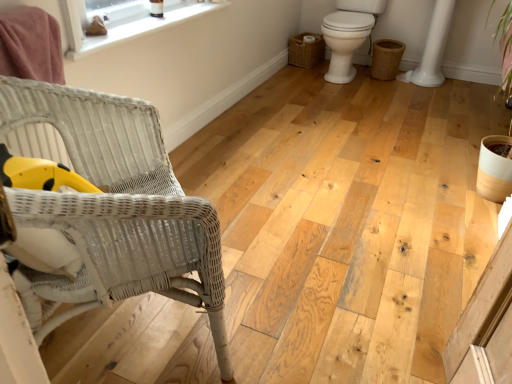
The width and height of the screenshot is (512, 384). What do you see at coordinates (306, 50) in the screenshot?
I see `woven brown basket at right, the first basket when ordered from left to right` at bounding box center [306, 50].

Where is `white wicker chair at left`? white wicker chair at left is located at coordinates 115,210.

Locate an element on the screen. The height and width of the screenshot is (384, 512). woven brown basket at right, the first basket when ordered from left to right is located at coordinates (306, 50).

Considering the sizes of objects white wicker chair at left and woven brown basket at right, the first basket when ordered from left to right, in the image provided, who is taller, white wicker chair at left or woven brown basket at right, the first basket when ordered from left to right,?

With more height is white wicker chair at left.

Between white wicker chair at left and woven brown basket at right, the first basket when ordered from left to right, which one has smaller size?

woven brown basket at right, the first basket when ordered from left to right.

Is white wicker chair at left next to woven brown basket at right, the second basket viewed from the right?

No, white wicker chair at left is not in contact with woven brown basket at right, the second basket viewed from the right.

Is white wicker chair at left located outside woven brown basket at right, the second basket viewed from the right?

Yes.

From the image's perspective, which is above, braided wicker basket at lower right, positioned as the 1th basket in right-to-left order, or white glossy toilet at right?

white glossy toilet at right, from the image's perspective.

Based on their sizes in the image, would you say braided wicker basket at lower right, the second basket when ordered from left to right, is bigger or smaller than white glossy toilet at right?

In the image, braided wicker basket at lower right, the second basket when ordered from left to right, appears to be smaller than white glossy toilet at right.

Is braided wicker basket at lower right, the second basket when ordered from left to right, not close to white glossy toilet at right?

No, braided wicker basket at lower right, the second basket when ordered from left to right, is in close proximity to white glossy toilet at right.

From a real-world perspective, who is located lower, braided wicker basket at lower right, the second basket when ordered from left to right, or white glossy toilet at right?

In real-world perspective, braided wicker basket at lower right, the second basket when ordered from left to right, is lower.

From the image's perspective, is white smooth window sill at upper left located above white glossy toilet at right?

No, from the image's perspective, white smooth window sill at upper left is not over white glossy toilet at right.

Is point (143, 10) closer or farther from the camera than point (362, 36)?

Point (143, 10) is closer to the camera than point (362, 36).

Is white smooth window sill at upper left facing towards white glossy toilet at right?

No, white smooth window sill at upper left is not facing towards white glossy toilet at right.

Is white smooth window sill at upper left directly adjacent to white glossy toilet at right?

white smooth window sill at upper left and white glossy toilet at right are clearly separated.

The image size is (512, 384). Find the location of `basket lying on the left of braided wicker basket at lower right, positioned as the 1th basket in right-to-left order`. basket lying on the left of braided wicker basket at lower right, positioned as the 1th basket in right-to-left order is located at coordinates (306, 50).

Is point (308, 49) farther from viewer compared to point (389, 47)?

Yes.

From the image's perspective, is woven brown basket at right, the second basket viewed from the right, beneath braided wicker basket at lower right, positioned as the 1th basket in right-to-left order?

No.

Between white wicker chair at left and white glossy toilet at right, which one appears on the right side from the viewer's perspective?

white glossy toilet at right.

Can you tell me how much white wicker chair at left and white glossy toilet at right differ in facing direction?

The facing directions of white wicker chair at left and white glossy toilet at right are 136 degrees apart.

Does white wicker chair at left touch white glossy toilet at right?

No.

From the image's perspective, would you say white wicker chair at left is shown under white glossy toilet at right?

Indeed, from the image's perspective, white wicker chair at left is shown beneath white glossy toilet at right.

From the image's perspective, is white smooth window sill at upper left on braided wicker basket at lower right, positioned as the 1th basket in right-to-left order?

No.

Is white smooth window sill at upper left inside the boundaries of braided wicker basket at lower right, the second basket when ordered from left to right, or outside?

white smooth window sill at upper left exists outside the volume of braided wicker basket at lower right, the second basket when ordered from left to right.

From a real-world perspective, which object rests below the other?

From a 3D spatial view, braided wicker basket at lower right, the second basket when ordered from left to right, is below.

How many degrees apart are the facing directions of white smooth window sill at upper left and braided wicker basket at lower right, positioned as the 1th basket in right-to-left order?

They differ by 96 degrees in their facing directions.

From a real-world perspective, which is physically above, white glossy toilet at right or white smooth window sill at upper left?

white smooth window sill at upper left, from a real-world perspective.

Which is behind, point (357, 26) or point (170, 7)?

The point (357, 26) is more distant.

Is white glossy toilet at right completely or partially outside of white smooth window sill at upper left?

Yes, white glossy toilet at right is located beyond the bounds of white smooth window sill at upper left.

How far apart are white glossy toilet at right and white smooth window sill at upper left?

The distance of white glossy toilet at right from white smooth window sill at upper left is 1.30 meters.

Where is `the 2nd basket positioned above the white wicker chair at left (from the image's perspective)`? the 2nd basket positioned above the white wicker chair at left (from the image's perspective) is located at coordinates (306, 50).

The image size is (512, 384). I want to click on basket that appears on the right of white glossy toilet at right, so click(x=386, y=59).

Estimate the real-world distances between objects in this image. Which object is closer to woven brown basket at right, the first basket when ordered from left to right, white smooth window sill at upper left or white wicker chair at left?

white smooth window sill at upper left is closer to woven brown basket at right, the first basket when ordered from left to right.

When comparing their distances from white smooth window sill at upper left, does white glossy toilet at right or woven brown basket at right, the second basket viewed from the right, seem further?

Based on the image, woven brown basket at right, the second basket viewed from the right, appears to be further to white smooth window sill at upper left.

Looking at this image, when comparing their distances from white wicker chair at left, does woven brown basket at right, the first basket when ordered from left to right, or white glossy toilet at right seem further?

Among the two, woven brown basket at right, the first basket when ordered from left to right, is located further to white wicker chair at left.

Which object lies further to the anchor point white glossy toilet at right, white wicker chair at left or woven brown basket at right, the first basket when ordered from left to right?

The object further to white glossy toilet at right is white wicker chair at left.

Which object lies nearer to the anchor point woven brown basket at right, the first basket when ordered from left to right, braided wicker basket at lower right, the second basket when ordered from left to right, or white glossy toilet at right?

The object closer to woven brown basket at right, the first basket when ordered from left to right, is white glossy toilet at right.

Estimate the real-world distances between objects in this image. Which object is further from white glossy toilet at right, white wicker chair at left or braided wicker basket at lower right, the second basket when ordered from left to right?

white wicker chair at left lies further to white glossy toilet at right than the other object.

Which object lies further to the anchor point white smooth window sill at upper left, woven brown basket at right, the first basket when ordered from left to right, or braided wicker basket at lower right, positioned as the 1th basket in right-to-left order?

braided wicker basket at lower right, positioned as the 1th basket in right-to-left order, is positioned further to the anchor white smooth window sill at upper left.

Based on their spatial positions, is braided wicker basket at lower right, the second basket when ordered from left to right, or white smooth window sill at upper left closer to white glossy toilet at right?

The object closer to white glossy toilet at right is braided wicker basket at lower right, the second basket when ordered from left to right.

Locate an element on the screen. basket located between white wicker chair at left and woven brown basket at right, the second basket viewed from the right, in the depth direction is located at coordinates (386, 59).

Where is `toilet between white smooth window sill at upper left and woven brown basket at right, the first basket when ordered from left to right, along the z-axis`? toilet between white smooth window sill at upper left and woven brown basket at right, the first basket when ordered from left to right, along the z-axis is located at coordinates 345,41.

Where is `window between white wicker chair at left and braided wicker basket at lower right, the second basket when ordered from left to right, along the z-axis`? This screenshot has width=512, height=384. window between white wicker chair at left and braided wicker basket at lower right, the second basket when ordered from left to right, along the z-axis is located at coordinates click(x=126, y=23).

You are a GUI agent. You are given a task and a screenshot of the screen. Output one action in this format:
    pyautogui.click(x=<x>, y=<y>)
    Task: Click on the basket between white smooth window sill at upper left and woven brown basket at right, the first basket when ordered from left to right, from front to back
    
    Given the screenshot: What is the action you would take?
    pyautogui.click(x=386, y=59)